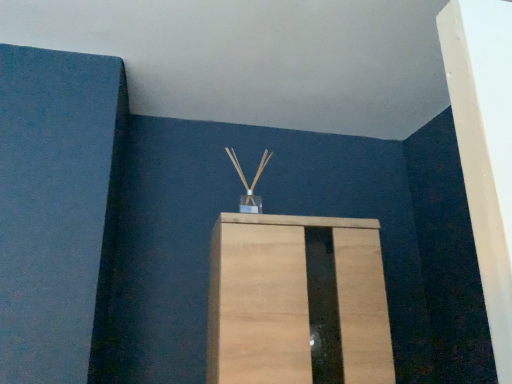
The width and height of the screenshot is (512, 384). What do you see at coordinates (297, 301) in the screenshot?
I see `light brown wood cabinet at center` at bounding box center [297, 301].

This screenshot has width=512, height=384. Find the location of `light brown wood cabinet at center`. light brown wood cabinet at center is located at coordinates (297, 301).

Locate an element on the screen. light brown wood cabinet at center is located at coordinates (297, 301).